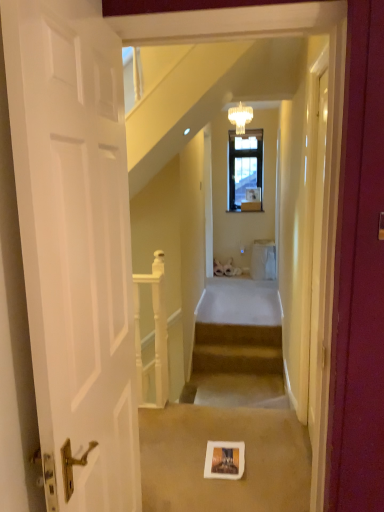
You are a GUI agent. You are given a task and a screenshot of the screen. Output one action in this format:
    pyautogui.click(x=<x>, y=<y>)
    Task: Click on the crystal glass chandelier at upper center
    
    Given the screenshot: What is the action you would take?
    pyautogui.click(x=240, y=117)

This screenshot has height=512, width=384. What do you see at coordinates (237, 349) in the screenshot?
I see `carpeted stairs at center` at bounding box center [237, 349].

Identify the location of crystal glass chandelier at upper center. The image size is (384, 512). (240, 117).

From a real-world perspective, is crystal glass chandelier at upper center positioned above or below white cardboard picture frame at center?

From a real-world perspective, crystal glass chandelier at upper center is physically above white cardboard picture frame at center.

Identify the location of light fixture behind the white cardboard picture frame at center. (240, 117).

Does point (246, 123) come in front of point (223, 457)?

That is False.

Is crystal glass chandelier at upper center inside the boundaries of white cardboard picture frame at center, or outside?

crystal glass chandelier at upper center lies outside white cardboard picture frame at center.

From the image's perspective, does white wooden railing at center appear higher than white cardboard picture frame at center?

Yes, from the image's perspective, white wooden railing at center is on top of white cardboard picture frame at center.

Is white wooden railing at center closer to camera compared to white cardboard picture frame at center?

No.

Considering the sizes of objects white wooden railing at center and white cardboard picture frame at center in the image provided, who is thinner, white wooden railing at center or white cardboard picture frame at center?

With smaller width is white wooden railing at center.

Is white wooden railing at center spatially inside white cardboard picture frame at center, or outside of it?

The correct answer is: outside.

Considering the sizes of objects white cardboard picture frame at center and carpeted stairs at center in the image provided, who is taller, white cardboard picture frame at center or carpeted stairs at center?

Standing taller between the two is carpeted stairs at center.

How different are the orientations of white cardboard picture frame at center and carpeted stairs at center in degrees?

There is a 1.48-degree angle between the facing directions of white cardboard picture frame at center and carpeted stairs at center.

Does white cardboard picture frame at center appear on the right side of carpeted stairs at center?

No.

Which of these two, crystal glass chandelier at upper center or carpeted stairs at center, is bigger?

Bigger between the two is carpeted stairs at center.

Does crystal glass chandelier at upper center appear on the left side of carpeted stairs at center?

No.

From the image's perspective, is crystal glass chandelier at upper center above or below carpeted stairs at center?

crystal glass chandelier at upper center is above carpeted stairs at center.

Considering the relative sizes of crystal glass chandelier at upper center and white wooden railing at center in the image provided, is crystal glass chandelier at upper center smaller than white wooden railing at center?

Indeed, crystal glass chandelier at upper center has a smaller size compared to white wooden railing at center.

Is crystal glass chandelier at upper center in front of or behind white wooden railing at center in the image?

Clearly, crystal glass chandelier at upper center is behind white wooden railing at center.

Is crystal glass chandelier at upper center positioned with its back to white wooden railing at center?

No, crystal glass chandelier at upper center's orientation is not away from white wooden railing at center.

Is white cardboard picture frame at center positioned with its back to crystal glass chandelier at upper center?

No, white cardboard picture frame at center is not facing the opposite direction of crystal glass chandelier at upper center.

Is white cardboard picture frame at center positioned in front of crystal glass chandelier at upper center?

Yes, white cardboard picture frame at center is closer to the camera.

Which point is more forward, [218,459] or [238,132]?

Point [218,459]

Based on the photo, does white cardboard picture frame at center have a smaller size compared to crystal glass chandelier at upper center?

Yes.

Could you tell me if carpeted stairs at center is turned towards white cardboard picture frame at center?

Yes, carpeted stairs at center is turned towards white cardboard picture frame at center.

Is carpeted stairs at center positioned beyond the bounds of white cardboard picture frame at center?

carpeted stairs at center is positioned outside white cardboard picture frame at center.

Is carpeted stairs at center touching white cardboard picture frame at center?

No, carpeted stairs at center is not with white cardboard picture frame at center.

From a real-world perspective, is carpeted stairs at center above or below white cardboard picture frame at center?

carpeted stairs at center is situated lower than white cardboard picture frame at center in the real world.

At what (x,y) coordinates should I click in order to perform the action: click on light fixture that is above the white cardboard picture frame at center (from a real-world perspective). Please return your answer as a coordinate pair (x, y). Image resolution: width=384 pixels, height=512 pixels. Looking at the image, I should click on (240, 117).

You are a GUI agent. You are given a task and a screenshot of the screen. Output one action in this format:
    pyautogui.click(x=<x>, y=<y>)
    Task: Click on the picture frame on the right of the white wooden railing at center
    
    Given the screenshot: What is the action you would take?
    pyautogui.click(x=224, y=460)

Based on the photo, based on their spatial positions, is crystal glass chandelier at upper center or white cardboard picture frame at center closer to carpeted stairs at center?

white cardboard picture frame at center.

Looking at this image, from the image, which object appears to be nearer to white cardboard picture frame at center, crystal glass chandelier at upper center or carpeted stairs at center?

Among the two, carpeted stairs at center is located nearer to white cardboard picture frame at center.

Based on their spatial positions, is white wooden railing at center or carpeted stairs at center closer to white cardboard picture frame at center?

Based on the image, white wooden railing at center appears to be nearer to white cardboard picture frame at center.

Consider the image. Which object lies nearer to the anchor point crystal glass chandelier at upper center, white cardboard picture frame at center or white wooden railing at center?

white wooden railing at center is positioned closer to the anchor crystal glass chandelier at upper center.

When comparing their distances from white wooden railing at center, does carpeted stairs at center or white cardboard picture frame at center seem closer?

The object closer to white wooden railing at center is white cardboard picture frame at center.

From the picture: Looking at the image, which one is located further to crystal glass chandelier at upper center, white wooden railing at center or white cardboard picture frame at center?

Among the two, white cardboard picture frame at center is located further to crystal glass chandelier at upper center.

Looking at the image, which one is located closer to carpeted stairs at center, white cardboard picture frame at center or white wooden railing at center?

The object closer to carpeted stairs at center is white wooden railing at center.

When comparing their distances from carpeted stairs at center, does white cardboard picture frame at center or crystal glass chandelier at upper center seem further?

Among the two, crystal glass chandelier at upper center is located further to carpeted stairs at center.

Find the location of a particular element. rail between crystal glass chandelier at upper center and white cardboard picture frame at center vertically is located at coordinates (154, 336).

Where is `rail that lies between crystal glass chandelier at upper center and carpeted stairs at center from top to bottom`? This screenshot has width=384, height=512. rail that lies between crystal glass chandelier at upper center and carpeted stairs at center from top to bottom is located at coordinates (154, 336).

At what (x,y) coordinates should I click in order to perform the action: click on rail located between white cardboard picture frame at center and carpeted stairs at center in the depth direction. Please return your answer as a coordinate pair (x, y). This screenshot has height=512, width=384. Looking at the image, I should click on (154, 336).

You are a GUI agent. You are given a task and a screenshot of the screen. Output one action in this format:
    pyautogui.click(x=<x>, y=<y>)
    Task: Click on the stairs that lies between crystal glass chandelier at upper center and white cardboard picture frame at center from top to bottom
    This screenshot has width=384, height=512.
    Given the screenshot: What is the action you would take?
    pyautogui.click(x=237, y=349)